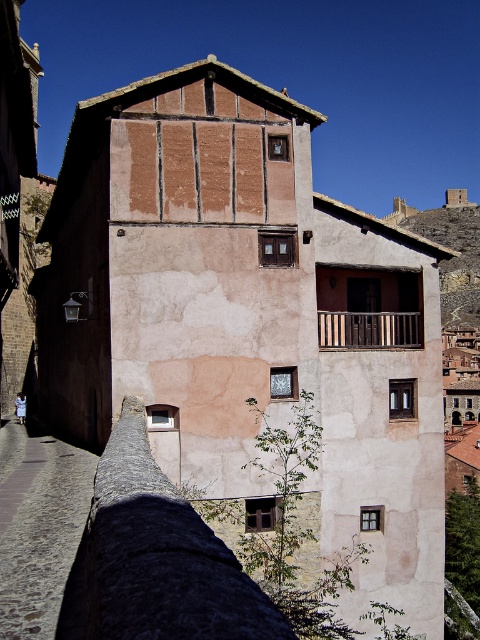
Question: Is cobblestone alley at lower left smaller than wooden at center?

Choices:
 (A) yes
 (B) no

Answer: (B)

Question: Is cobblestone alley at lower left bigger than wooden at center?

Choices:
 (A) yes
 (B) no

Answer: (A)

Question: Is cobblestone alley at lower left bigger than wooden at center?

Choices:
 (A) no
 (B) yes

Answer: (B)